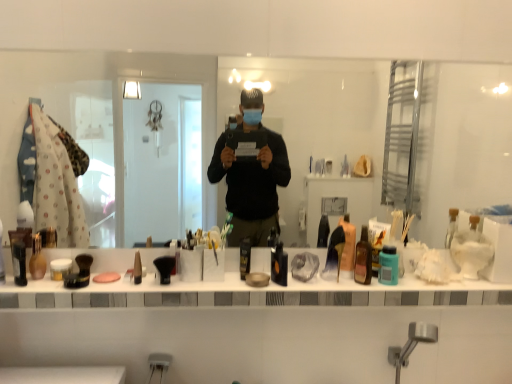
Question: From a real-world perspective, relative to black matte container at center, arranged as the sixth toiletry when viewed from the right, is pink matte soap at center vertically above or below?

Choices:
 (A) below
 (B) above

Answer: (A)

Question: Does point (108, 281) appear closer or farther from the camera than point (244, 243)?

Choices:
 (A) farther
 (B) closer

Answer: (B)

Question: Which object is the closest to the matte brown vase at left, the 9th toiletry positioned from the right?

Choices:
 (A) white matte shaving cream at right
 (B) black glossy bottle at center, positioned as the 5th toiletry in right-to-left order
 (C) brown glass bottle at right, which is the third toiletry from right to left
 (D) transparent glass mirror at center
 (E) white matte jar at center, which is the third toiletry in left-to-right order

Answer: (E)

Question: Based on their relative distances, which object is farther from the matte black brush at center, acting as the 4th toiletry starting from the left?

Choices:
 (A) black matte container at center, which ranks as the fifth toiletry in left-to-right order
 (B) white matte jar at center, which is the third toiletry in left-to-right order
 (C) translucent plastic bottle at center, which is counted as the 7th toiletry, starting from the left
 (D) matte black shaving brush at left, the first toiletry in the left-to-right sequence
 (E) matte brown vase at left, the 2th toiletry viewed from the left

Answer: (C)